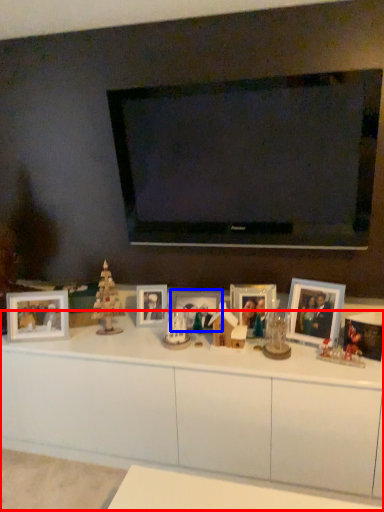
Question: Which point is closer to the camera, table (highlighted by a red box) or picture frame (highlighted by a blue box)?

Choices:
 (A) table
 (B) picture frame

Answer: (A)